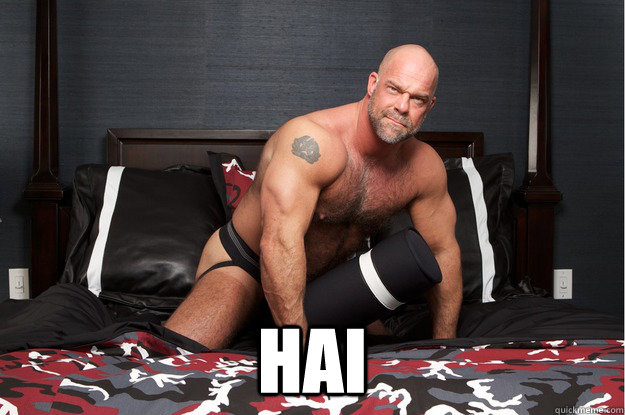
Locate an element on the screen. outlet is located at coordinates (560, 272).